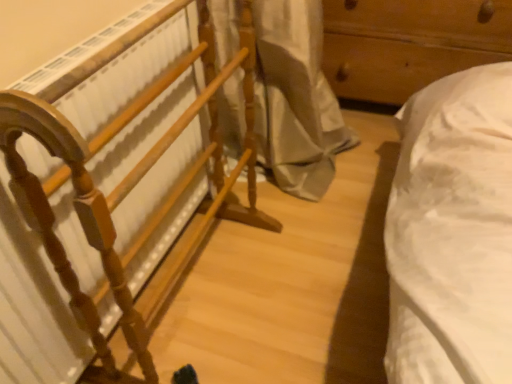
Question: From the image's perspective, would you say wooden rack at left, the 1th furniture when ordered from left to right, is positioned over wooden drawer at right, which is counted as the first furniture, starting from the right?

Choices:
 (A) yes
 (B) no

Answer: (B)

Question: Is the surface of wooden rack at left, which is counted as the 2th furniture, starting from the back, in direct contact with wooden drawer at right, positioned as the first furniture in back-to-front order?

Choices:
 (A) yes
 (B) no

Answer: (B)

Question: Considering the relative positions of wooden rack at left, the 1th furniture when ordered from left to right, and wooden drawer at right, which is counted as the first furniture, starting from the right, in the image provided, is wooden rack at left, the 1th furniture when ordered from left to right, behind wooden drawer at right, which is counted as the first furniture, starting from the right,?

Choices:
 (A) yes
 (B) no

Answer: (B)

Question: Can you confirm if wooden rack at left, which is counted as the 2th furniture, starting from the back, is positioned to the left of wooden drawer at right, positioned as the first furniture in back-to-front order?

Choices:
 (A) yes
 (B) no

Answer: (A)

Question: Could you tell me if wooden rack at left, the 1th furniture when ordered from left to right, is turned towards wooden drawer at right, positioned as the first furniture in back-to-front order?

Choices:
 (A) yes
 (B) no

Answer: (B)

Question: Considering the relative sizes of wooden rack at left, the 1th furniture when ordered from left to right, and wooden drawer at right, which is counted as the first furniture, starting from the right, in the image provided, is wooden rack at left, the 1th furniture when ordered from left to right, bigger than wooden drawer at right, which is counted as the first furniture, starting from the right,?

Choices:
 (A) yes
 (B) no

Answer: (B)

Question: Is wooden drawer at right, which is counted as the first furniture, starting from the right, looking in the opposite direction of wooden rack at left, which is counted as the 2th furniture, starting from the back?

Choices:
 (A) yes
 (B) no

Answer: (B)

Question: Does wooden drawer at right, positioned as the first furniture in back-to-front order, appear on the right side of wooden rack at left, placed as the 1th furniture when sorted from front to back?

Choices:
 (A) yes
 (B) no

Answer: (A)

Question: Does wooden drawer at right, which is the 2th furniture in left-to-right order, have a greater width compared to wooden rack at left, which is counted as the 2th furniture, starting from the back?

Choices:
 (A) yes
 (B) no

Answer: (A)

Question: Does wooden drawer at right, which is the 2th furniture in left-to-right order, have a lesser height compared to wooden rack at left, which is counted as the 2th furniture, starting from the back?

Choices:
 (A) no
 (B) yes

Answer: (B)

Question: From the image's perspective, is wooden drawer at right, which is the 2th furniture in left-to-right order, under wooden rack at left, the 1th furniture when ordered from left to right?

Choices:
 (A) no
 (B) yes

Answer: (A)

Question: From a real-world perspective, is wooden drawer at right, the second furniture when ordered from front to back, beneath wooden rack at left, the second furniture from the right?

Choices:
 (A) no
 (B) yes

Answer: (B)

Question: Considering the relative positions of wooden drawer at right, the second furniture when ordered from front to back, and wooden rack at left, the second furniture from the right, in the image provided, is wooden drawer at right, the second furniture when ordered from front to back, to the left or to the right of wooden rack at left, the second furniture from the right,?

Choices:
 (A) left
 (B) right

Answer: (B)